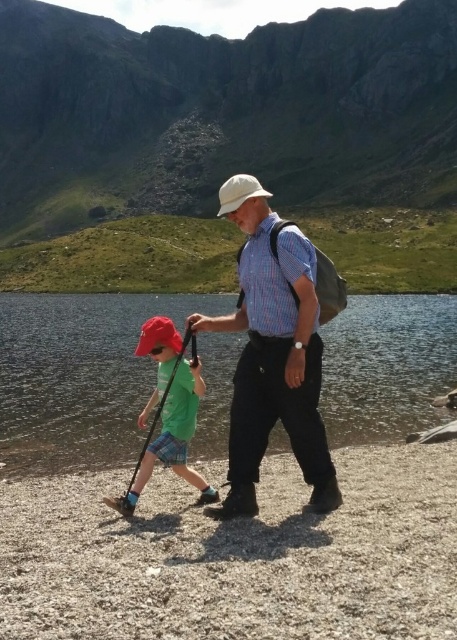
Can you confirm if clear water at lower center is thinner than white matte baseball hat at center?

No, clear water at lower center is not thinner than white matte baseball hat at center.

Locate an element on the screen. Image resolution: width=457 pixels, height=640 pixels. clear water at lower center is located at coordinates (78, 376).

Between point (165, 465) and point (256, 180), which one is positioned in front?

Point (256, 180) is more forward.

What do you see at coordinates (168, 412) in the screenshot?
I see `green matte shirt at center` at bounding box center [168, 412].

Is point (179, 404) closer to viewer compared to point (228, 186)?

Yes, point (179, 404) is in front of point (228, 186).

You are a GUI agent. You are given a task and a screenshot of the screen. Output one action in this format:
    pyautogui.click(x=<x>, y=<y>)
    Task: Click on the green matte shirt at center
    This screenshot has height=640, width=457.
    Given the screenshot: What is the action you would take?
    pyautogui.click(x=168, y=412)

The image size is (457, 640). Describe the element at coordinates (78, 376) in the screenshot. I see `clear water at lower center` at that location.

Who is higher up, clear water at lower center or plaid cotton shirt at center?

Positioned higher is clear water at lower center.

Identify the location of clear water at lower center. This screenshot has width=457, height=640. (78, 376).